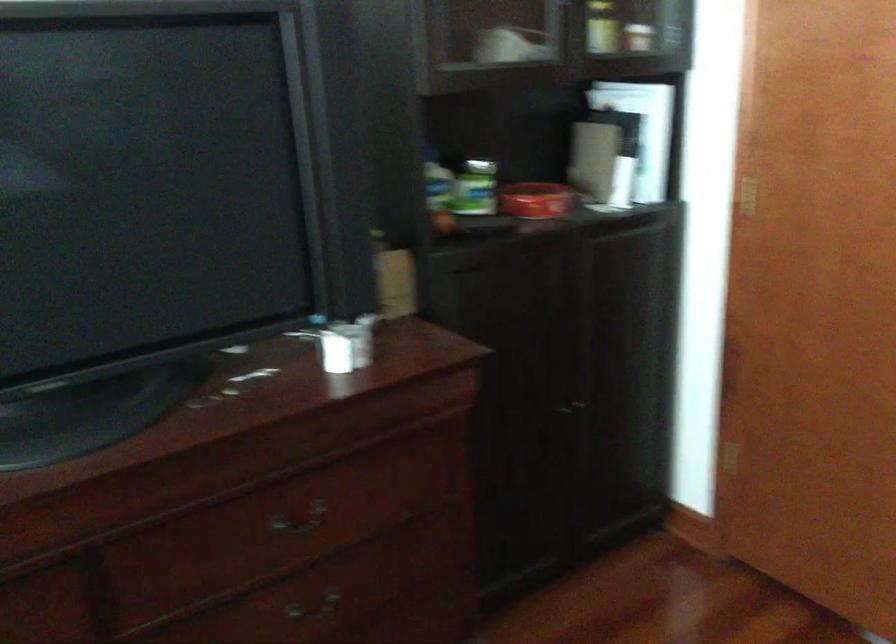
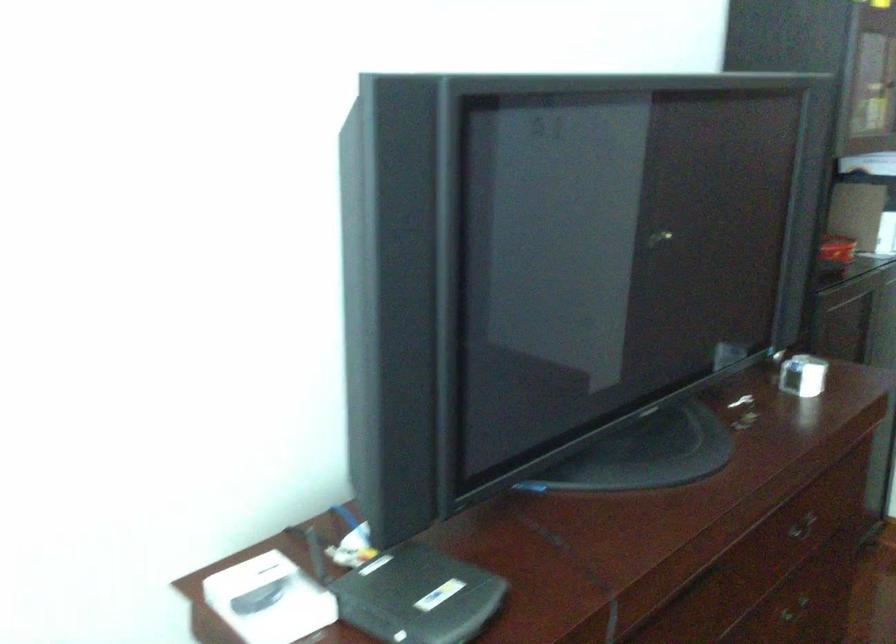
Question: Which direction would the cameraman need to move to produce the second image? Reply with the corresponding letter.

Choices:
 (A) Left
 (B) Right
 (C) Forward
 (D) Backward

Answer: (A)